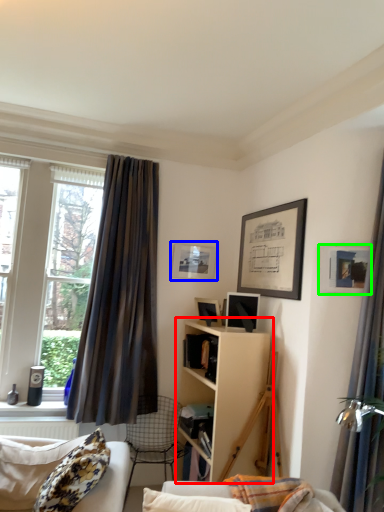
Question: Which object is positioned farthest from shelf (highlighted by a red box)? Select from picture frame (highlighted by a blue box) and picture frame (highlighted by a green box).

Choices:
 (A) picture frame
 (B) picture frame

Answer: (A)